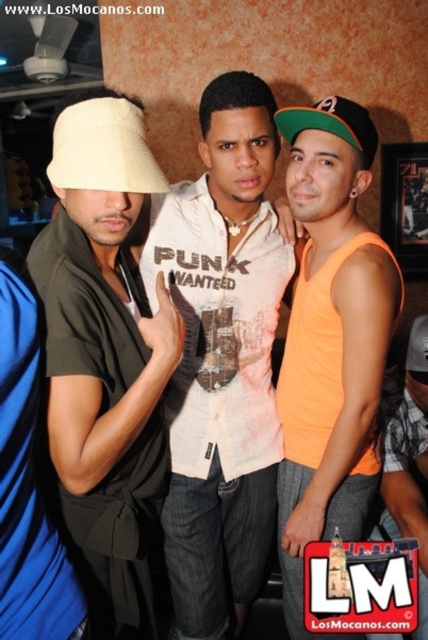
Based on the scene description, which baseball cap is shorter in height between the green fabric baseball cap at upper center and the orange fabric baseball cap at center?

The green fabric baseball cap at upper center is shorter in height compared to the orange fabric baseball cap at center.

Looking at the two baseball caps in the image, the green fabric baseball cap at upper center and the orange fabric baseball cap at center, which one is positioned higher up?

The green fabric baseball cap at upper center is positioned higher up than the orange fabric baseball cap at center.

You are taking a photo of the matte beige hat at left and the orange fabric tank top at right. Which object should you focus on first to ensure both are in focus?

You should focus on the matte beige hat at left first because it is closer to the viewer than the orange fabric tank top at right, so adjusting focus from near to far will help both be in focus.